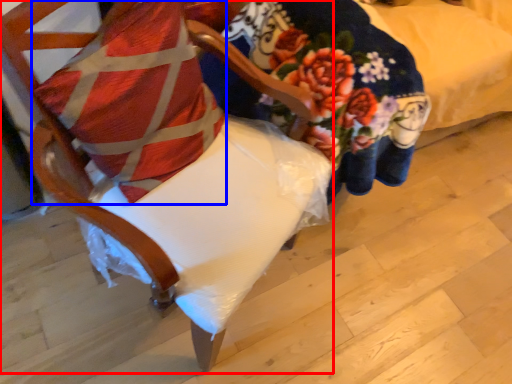
Question: Which point is closer to the camera, chair (highlighted by a red box) or pillow (highlighted by a blue box)?

Choices:
 (A) chair
 (B) pillow

Answer: (A)